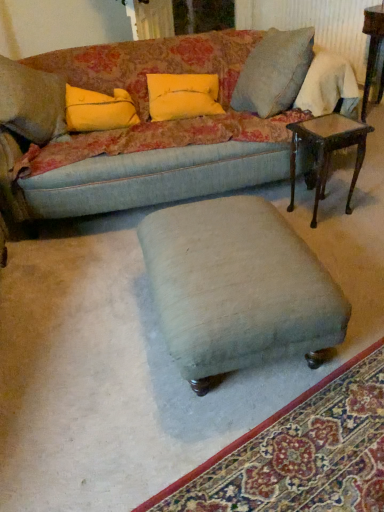
Question: From a real-world perspective, is yellow fabric pillow at upper left, which ranks as the first pillow in left-to-right order, positioned above or below mahogany wood side table at right, the 1th table in the bottom-to-top sequence?

Choices:
 (A) below
 (B) above

Answer: (B)

Question: From the image's perspective, is yellow fabric pillow at upper left, the 2th pillow from the right, above or below mahogany wood side table at right, placed as the first table when sorted from left to right?

Choices:
 (A) below
 (B) above

Answer: (B)

Question: Which object is the farthest from the yellow fabric pillow at upper center, the first pillow when ordered from right to left?

Choices:
 (A) yellow fabric pillow at upper left, the 2th pillow from the right
 (B) velvet fabric couch at upper center
 (C) velvet green ottoman at center
 (D) velvet green ottoman at center
 (E) wooden side table at upper right, which is the second table in left-to-right order

Answer: (D)

Question: Estimate the real-world distances between objects in this image. Which object is farther from the wooden side table at upper right, the 2th table ordered from the bottom?

Choices:
 (A) yellow fabric pillow at upper left, the 2th pillow from the right
 (B) yellow fabric pillow at upper center, the first pillow when ordered from right to left
 (C) velvet green ottoman at center
 (D) mahogany wood side table at right, the 1th table in the bottom-to-top sequence
 (E) velvet green ottoman at center

Answer: (E)